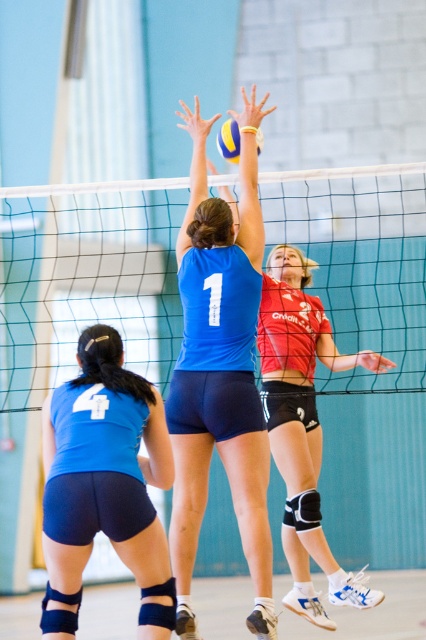
You are a referee standing at the center line of the volleyball court. You need to determine if the matte blue shorts at lower left is taller than the yellow matte volleyball at center. Based on the scene, what is your observation?

The matte blue shorts at lower left is much taller than the yellow matte volleyball at center.